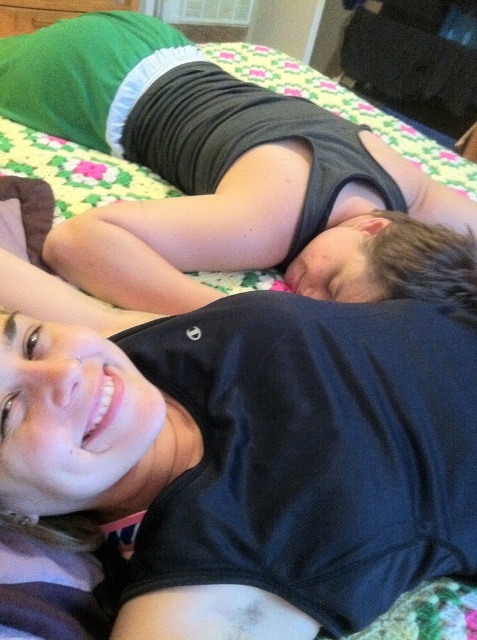
You are designing a clothing catalog and need to place two black matte tank tops in an image. The first is the black matte tank top at upper center and the second is the matte black tank top at center. Which tank top should you choose if you want the one that is larger?

The matte black tank top at center is larger than the black matte tank top at upper center, so you should choose the matte black tank top at center.